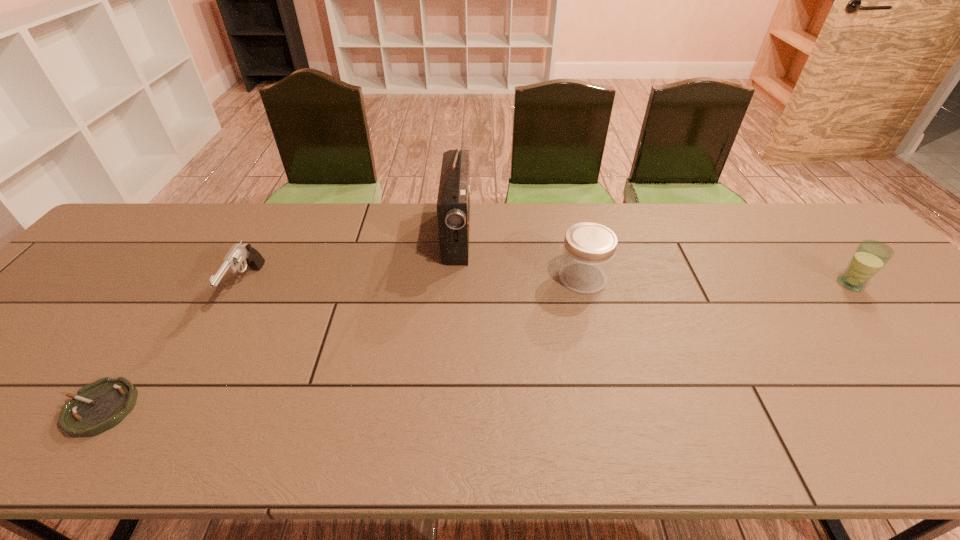
Locate an element on the screen. vacant area that lies between the radio receiver and the ashtray is located at coordinates (278, 321).

The height and width of the screenshot is (540, 960). In order to click on vacant space that is in between the jar and the gun in this screenshot , I will do (415, 282).

This screenshot has width=960, height=540. Identify the location of vacant space that is in between the fourth object from right to left and the jar. (415, 282).

Locate an element on the screen. The width and height of the screenshot is (960, 540). free spot between the gun and the rightmost object is located at coordinates (548, 286).

Image resolution: width=960 pixels, height=540 pixels. Identify the location of free point between the fourth object from right to left and the rightmost object. (548, 286).

In order to click on blank region between the second object from right to left and the third object from right to left in this screenshot , I will do `click(520, 256)`.

Find the location of a particular element. The image size is (960, 540). free area in between the gun and the glass is located at coordinates (548, 286).

In order to click on empty location between the jar and the tallest object in this screenshot , I will do `click(520, 256)`.

Find the location of a particular element. The height and width of the screenshot is (540, 960). unoccupied area between the second object from right to left and the gun is located at coordinates (415, 282).

Locate an element on the screen. The image size is (960, 540). free space that is in between the rightmost object and the gun is located at coordinates (548, 286).